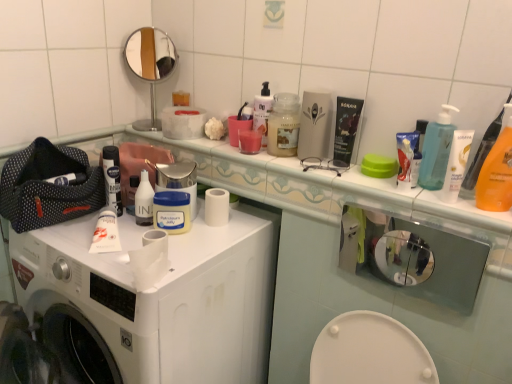
Question: Based on their sizes in the image, would you say white matte tube at center is bigger or smaller than white glossy lotion at upper right, acting as the first toiletry starting from the right?

Choices:
 (A) small
 (B) big

Answer: (B)

Question: Does point (96, 223) appear closer or farther from the camera than point (464, 157)?

Choices:
 (A) farther
 (B) closer

Answer: (A)

Question: Which is nearer to the orange plastic bottle at right?

Choices:
 (A) black matte tube at upper center, which is the 2th product from right to left
 (B) white matte toilet paper at center
 (C) white matte tube at center
 (D) translucent plastic cup at center, which ranks as the third mouthwash in left-to-right order
 (E) white plastic bottle at center, marked as the 2th toiletry in a front-to-back arrangement

Answer: (A)

Question: Estimate the real-world distances between objects in this image. Which object is farther from the translucent plastic pump bottle at upper right?

Choices:
 (A) white plastic bottle at center, acting as the 2th toiletry starting from the right
 (B) black matte tube at upper center, which is the 2th product from right to left
 (C) white matte washing machine at center
 (D) translucent plastic jar at center, the 4th mouthwash positioned from the left
 (E) white plastic container at upper right, which ranks as the second product in left-to-right order

Answer: (A)